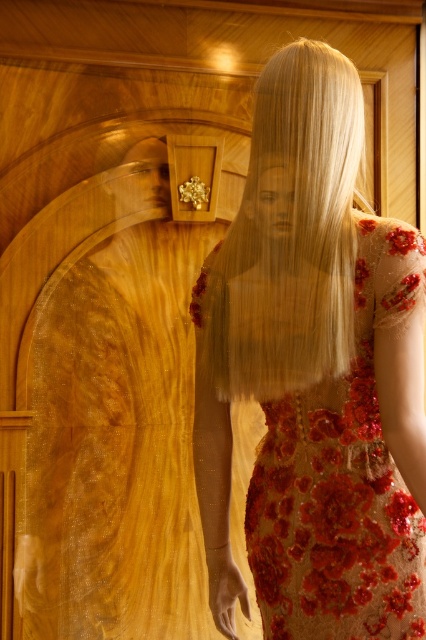
Does sequined fabric dress at center have a smaller size compared to blonde silky hair at center?

Actually, sequined fabric dress at center might be larger than blonde silky hair at center.

Is sequined fabric dress at center taller than blonde silky hair at center?

Yes.

Does point (247, 604) come behind point (262, 100)?

Yes, point (247, 604) is behind point (262, 100).

Image resolution: width=426 pixels, height=640 pixels. In order to click on sequined fabric dress at center in this screenshot , I will do `click(314, 374)`.